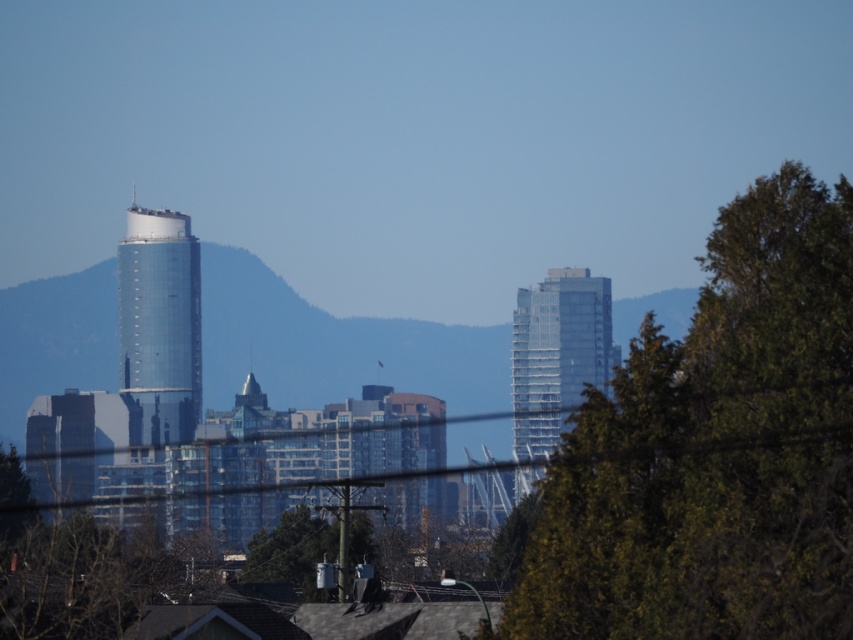
Which is below, green leafy tree at right or clear glass skyscraper at center?

green leafy tree at right is below.

Is green leafy tree at right further to the viewer compared to clear glass skyscraper at center?

No, green leafy tree at right is in front of clear glass skyscraper at center.

Does point (798, 371) lie in front of point (563, 337)?

Yes, point (798, 371) is closer to viewer.

The width and height of the screenshot is (853, 640). Identify the location of green leafy tree at right. (715, 451).

Who is lower down, green leafy tree at right or green matte tree at center?

Positioned lower is green matte tree at center.

Does green leafy tree at right have a greater width compared to green matte tree at center?

Correct, the width of green leafy tree at right exceeds that of green matte tree at center.

Where is `green leafy tree at right`? Image resolution: width=853 pixels, height=640 pixels. green leafy tree at right is located at coordinates (715, 451).

Which of these two, green leafy tree at right or green leafy tree at lower left, stands taller?

green leafy tree at right is taller.

Is green leafy tree at right below green leafy tree at lower left?

No.

I want to click on green leafy tree at right, so click(715, 451).